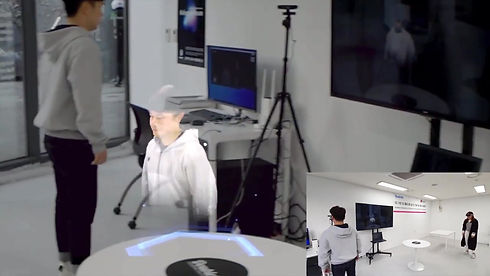
Identify the location of desktop tower on floor. pyautogui.click(x=244, y=209).